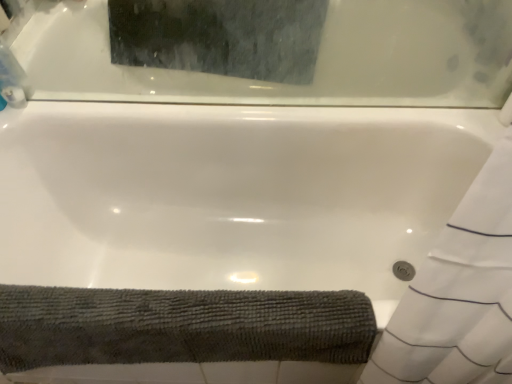
Question: From the image's perspective, is white glossy bathtub at upper center positioned above or below clear plastic bottle at upper left?

Choices:
 (A) below
 (B) above

Answer: (B)

Question: Is white glossy bathtub at upper center in front of or behind clear plastic bottle at upper left in the image?

Choices:
 (A) behind
 (B) front

Answer: (B)

Question: Which of these objects is positioned farthest from the clear plastic bottle at upper left?

Choices:
 (A) white glossy bathtub at upper center
 (B) dark gray textured bath towel at lower left

Answer: (B)

Question: Which is farther from the white glossy bathtub at upper center?

Choices:
 (A) dark gray textured bath towel at lower left
 (B) clear plastic bottle at upper left

Answer: (A)